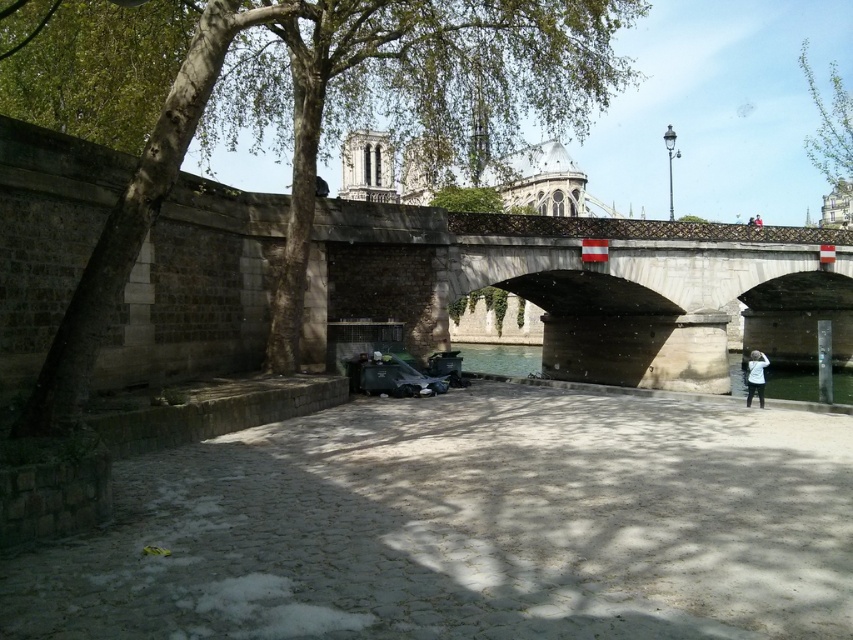
Does stone bridge at center come behind green leafy tree at center?

Yes, it is.

Measure the distance from stone bridge at center to green leafy tree at center.

stone bridge at center and green leafy tree at center are 70.05 feet apart from each other.

Describe the element at coordinates (659, 292) in the screenshot. The width and height of the screenshot is (853, 640). I see `stone bridge at center` at that location.

Find the location of `stone bridge at center`. stone bridge at center is located at coordinates (659, 292).

How distant is stone bridge at center from clear concrete waterway at center?

stone bridge at center is 61.65 feet away from clear concrete waterway at center.

How distant is stone bridge at center from clear concrete waterway at center?

stone bridge at center is 18.79 meters away from clear concrete waterway at center.

Which is in front, point (659, 260) or point (809, 385)?

Positioned in front is point (659, 260).

You are a GUI agent. You are given a task and a screenshot of the screen. Output one action in this format:
    pyautogui.click(x=<x>, y=<y>)
    Task: Click on the stone bridge at center
    This screenshot has width=853, height=640.
    Given the screenshot: What is the action you would take?
    pyautogui.click(x=659, y=292)

Which is below, stone bridge at center or green leafy tree at upper right?

stone bridge at center is lower down.

Does point (836, 292) come closer to viewer compared to point (840, 156)?

Yes, point (836, 292) is in front of point (840, 156).

Does point (694, 244) lie behind point (830, 129)?

No, it is in front of (830, 129).

Identify the location of stone bridge at center. The height and width of the screenshot is (640, 853). (659, 292).